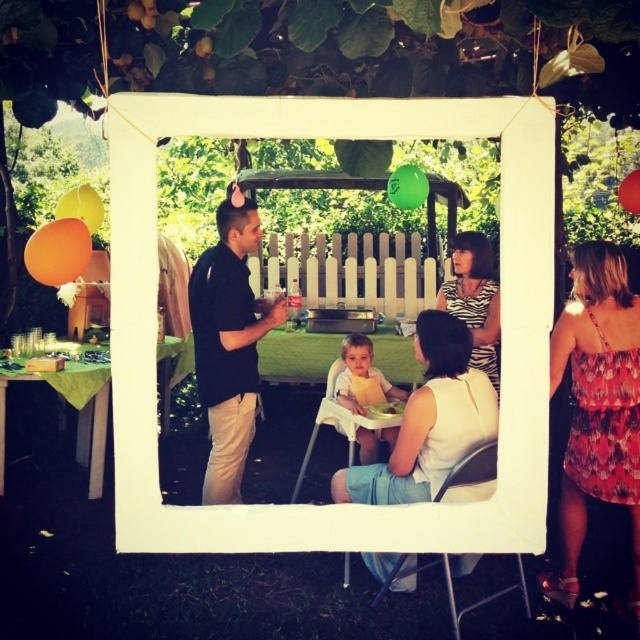
Question: Among these objects, which one is nearest to the camera?

Choices:
 (A) black cotton shirt at center
 (B) zebra print dress at center
 (C) floral print dress at upper right

Answer: (C)

Question: Which object is closer to the camera taking this photo?

Choices:
 (A) yellow rubber balloon at upper left
 (B) white fabric dress at center
 (C) orange matte balloon at upper left

Answer: (C)

Question: Is yellow bibbed baby at center closer to camera compared to red matte balloon at upper center?

Choices:
 (A) no
 (B) yes

Answer: (B)

Question: Which point is farther to the camera?

Choices:
 (A) red matte balloon at upper center
 (B) black cotton shirt at center

Answer: (A)

Question: Is zebra print dress at center wider than orange matte balloon at upper left?

Choices:
 (A) yes
 (B) no

Answer: (A)

Question: Can you confirm if zebra print dress at center is thinner than yellow bibbed baby at center?

Choices:
 (A) no
 (B) yes

Answer: (B)